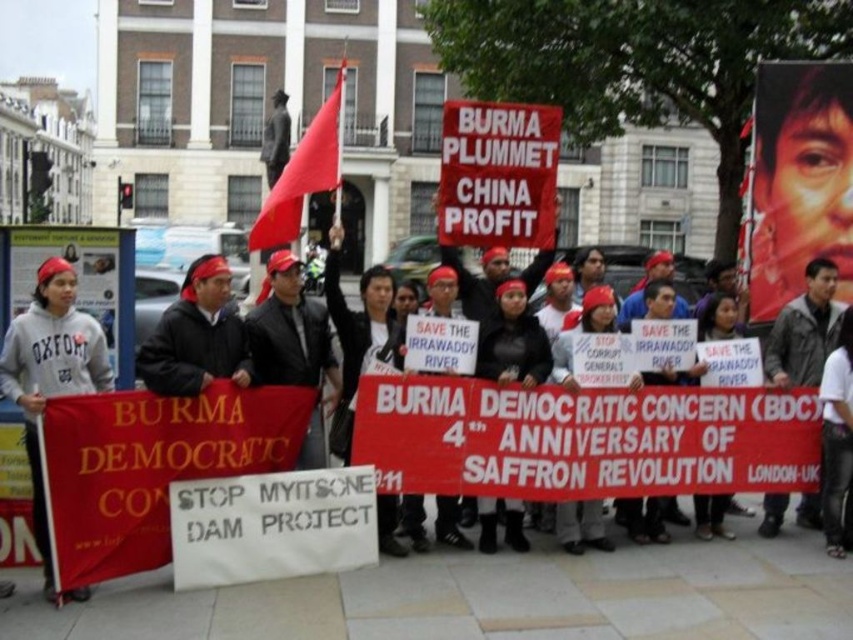
Question: Among these points, which one is farthest from the camera?

Choices:
 (A) (817, 259)
 (B) (579, 524)
 (C) (166, 365)

Answer: (A)

Question: Does red fabric banner at center have a lesser width compared to dark brown leather jacket at center?

Choices:
 (A) yes
 (B) no

Answer: (A)

Question: Based on their relative distances, which object is farther from the dark brown leather jacket at center?

Choices:
 (A) red fabric flag at upper center
 (B) matte black jacket at center
 (C) gray fleece sweatshirt at left

Answer: (C)

Question: Is matte black sign at center bigger than dark brown leather jacket at center?

Choices:
 (A) yes
 (B) no

Answer: (B)

Question: Which point is closer to the camera?

Choices:
 (A) red fabric banner at center
 (B) matte black jacket at center

Answer: (A)

Question: Does dark gray jacket at center appear over dark brown leather jacket at center?

Choices:
 (A) no
 (B) yes

Answer: (A)